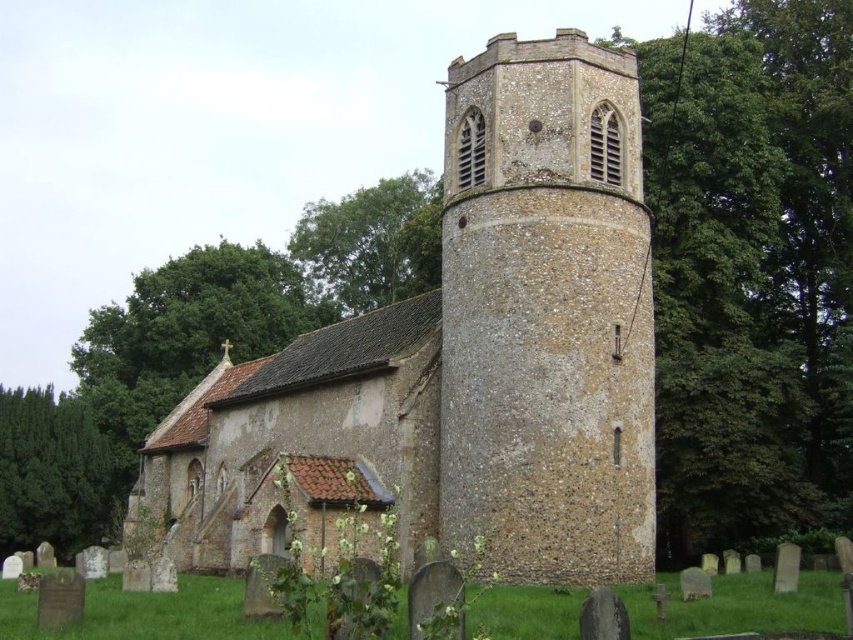
Question: Among these objects, which one is farthest from the camera?

Choices:
 (A) brown stone tower at center
 (B) brown stone church at center

Answer: (B)

Question: Does brown stone church at center have a greater width compared to brown stone tower at center?

Choices:
 (A) yes
 (B) no

Answer: (A)

Question: Which of the following is the farthest from the observer?

Choices:
 (A) (466, 211)
 (B) (459, 419)

Answer: (A)

Question: Can you confirm if brown stone church at center is positioned below brown stone tower at center?

Choices:
 (A) yes
 (B) no

Answer: (A)

Question: From the image, what is the correct spatial relationship of brown stone church at center in relation to brown stone tower at center?

Choices:
 (A) below
 (B) above

Answer: (A)